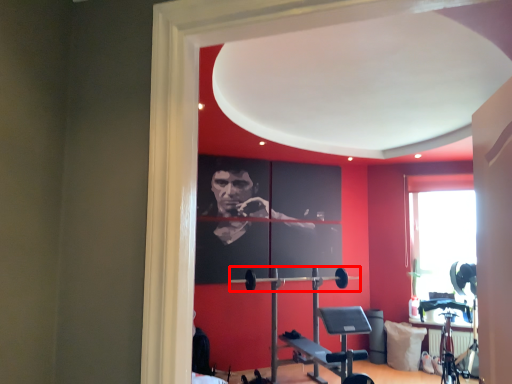
Question: From the image's perspective, what is the correct spatial relationship of barbell (annotated by the red box) in relation to pillow?

Choices:
 (A) below
 (B) above

Answer: (B)